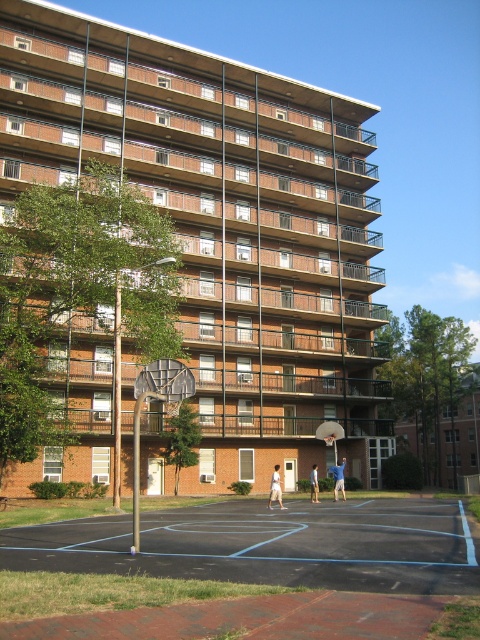
You are standing at the point with coordinates (x=269, y=545). What object are you standing on?

You are standing on the black asphalt basketball court at center.

You are standing at the point marked by coordinates point (269, 545) in the image. What is the nearest object to you?

The nearest object to you is the black asphalt basketball court at center, as the point (269, 545) represents its location.

You are standing at the basketball court looking towards the apartment building. There are two points marked on the building facade. The first point is at coordinates point (460, 531) and the second is at point (269, 484). Which point is closer to your current position?

Point (460, 531) is closer to the camera than point (269, 484), so the first point is closer to your current position.